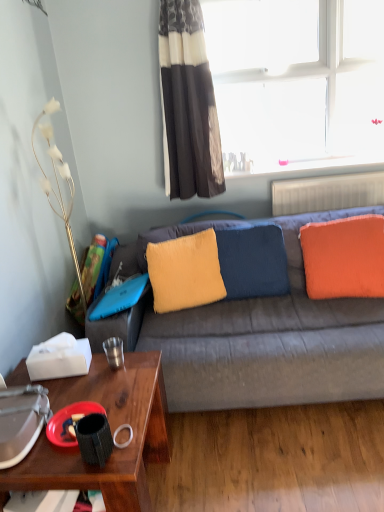
Question: From a real-world perspective, is velvety yellow pillow at center, which is the 2th pillow in right-to-left order, below metallic silver cup at lower left, marked as the 2th coffee cup in a front-to-back arrangement?

Choices:
 (A) yes
 (B) no

Answer: (B)

Question: Is metallic silver cup at lower left, the first coffee cup from the top, at the back of velvety yellow pillow at center, which is the 2th pillow in right-to-left order?

Choices:
 (A) yes
 (B) no

Answer: (B)

Question: Is velvety yellow pillow at center, which is the 2th pillow in right-to-left order, touching metallic silver cup at lower left, marked as the 2th coffee cup in a front-to-back arrangement?

Choices:
 (A) no
 (B) yes

Answer: (A)

Question: Is velvety yellow pillow at center, which appears as the 2th pillow when viewed from the left, oriented towards metallic silver cup at lower left, which is the 2th coffee cup in bottom-to-top order?

Choices:
 (A) yes
 (B) no

Answer: (B)

Question: Can you confirm if velvety yellow pillow at center, which appears as the 2th pillow when viewed from the left, is thinner than metallic silver cup at lower left, marked as the 2th coffee cup in a front-to-back arrangement?

Choices:
 (A) no
 (B) yes

Answer: (A)

Question: From their relative heights in the image, would you say transparent glass window at upper right is taller or shorter than wooden desk at lower left?

Choices:
 (A) tall
 (B) short

Answer: (A)

Question: Relative to wooden desk at lower left, is transparent glass window at upper right in front or behind?

Choices:
 (A) behind
 (B) front

Answer: (A)

Question: Would you say transparent glass window at upper right is inside or outside wooden desk at lower left?

Choices:
 (A) inside
 (B) outside

Answer: (B)

Question: In terms of width, does transparent glass window at upper right look wider or thinner when compared to wooden desk at lower left?

Choices:
 (A) wide
 (B) thin

Answer: (B)

Question: Looking at the image, does orange soft cushion at right, the 1th pillow viewed from the right, seem bigger or smaller compared to white plastic radiator at upper right?

Choices:
 (A) big
 (B) small

Answer: (A)

Question: Considering the positions of orange soft cushion at right, the 1th pillow viewed from the right, and white plastic radiator at upper right in the image, is orange soft cushion at right, the 1th pillow viewed from the right, taller or shorter than white plastic radiator at upper right?

Choices:
 (A) short
 (B) tall

Answer: (B)

Question: Considering the positions of point [x=372, y=289] and point [x=304, y=189], is point [x=372, y=289] closer or farther from the camera than point [x=304, y=189]?

Choices:
 (A) farther
 (B) closer

Answer: (B)

Question: In terms of width, does orange soft cushion at right, the 1th pillow viewed from the right, look wider or thinner when compared to white plastic radiator at upper right?

Choices:
 (A) thin
 (B) wide

Answer: (B)

Question: Looking at the image, does black and white striped curtain at upper center seem bigger or smaller compared to metallic silver cup at lower left, which is the 2th coffee cup in bottom-to-top order?

Choices:
 (A) small
 (B) big

Answer: (B)

Question: In the image, is black and white striped curtain at upper center positioned in front of or behind metallic silver cup at lower left, the first coffee cup from the top?

Choices:
 (A) behind
 (B) front

Answer: (A)